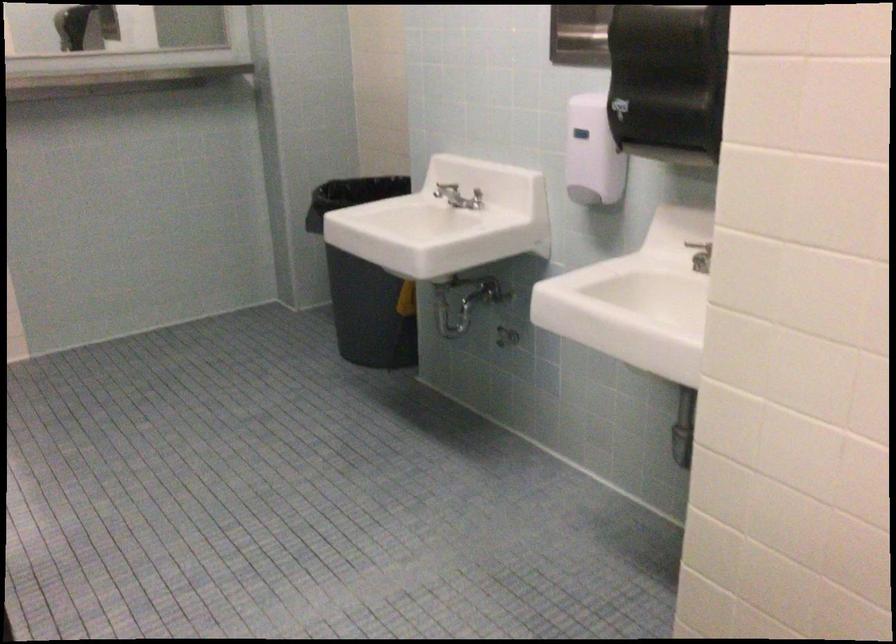
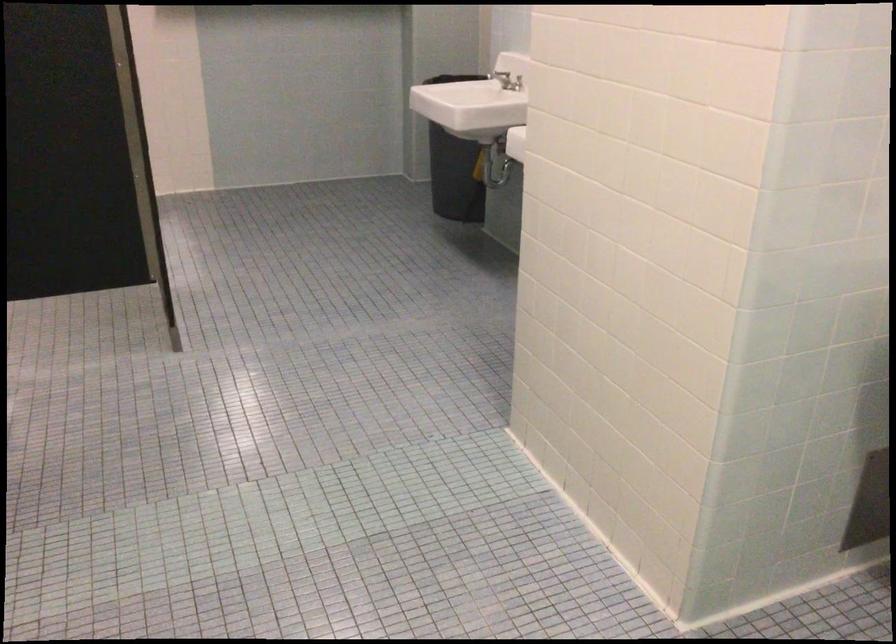
In the second image, find the point that corresponds to (x=433, y=194) in the first image.

(500, 75)